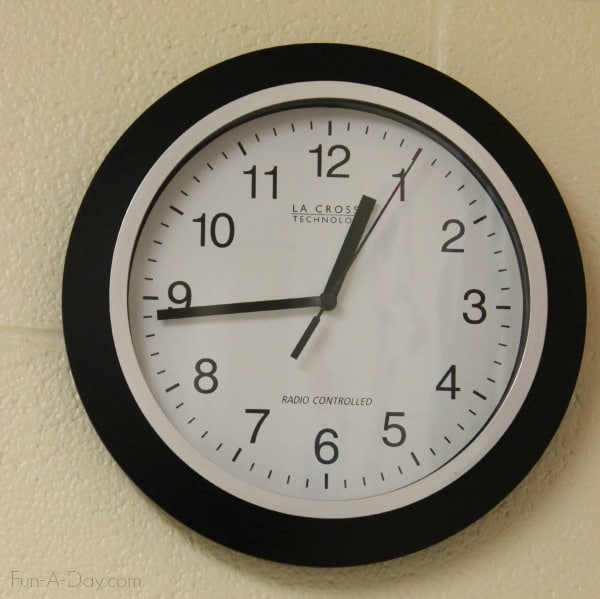
The width and height of the screenshot is (600, 599). What are the coordinates of `shadow from the clock on wall` in the screenshot? It's located at (333, 577).